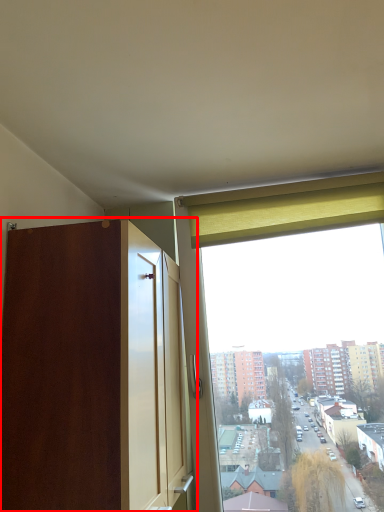
Question: From the image's perspective, considering the relative positions of dresser (annotated by the red box) and curtain in the image provided, where is dresser (annotated by the red box) located with respect to the staircase?

Choices:
 (A) below
 (B) above

Answer: (A)